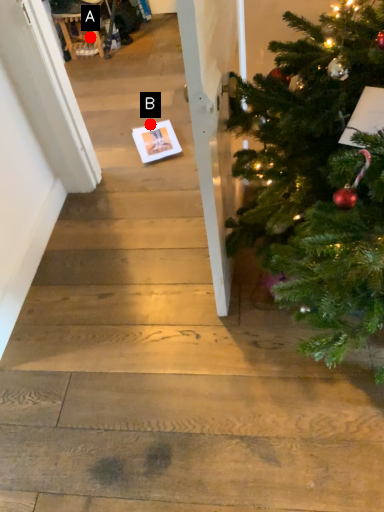
Question: Two points are circled on the image, labeled by A and B beside each circle. Which point appears closest to the camera in this image?

Choices:
 (A) A is closer
 (B) B is closer

Answer: (B)